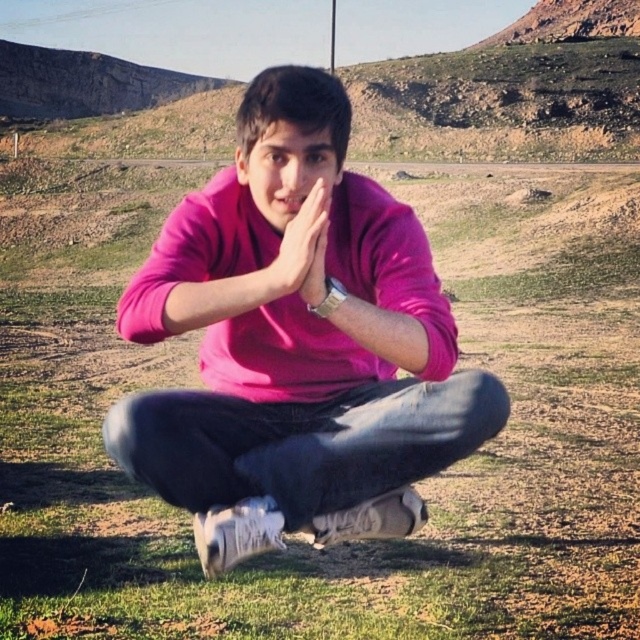
Is green grass at center to the right of pink matte hands at center from the viewer's perspective?

No, green grass at center is not to the right of pink matte hands at center.

Is green grass at center wider than pink matte hands at center?

Yes, green grass at center is wider than pink matte hands at center.

Where is `green grass at center`? green grass at center is located at coordinates (417, 486).

Find the location of a particular element. green grass at center is located at coordinates (417, 486).

Can you confirm if green grass at center is shorter than pink matte sweater at center?

In fact, green grass at center may be taller than pink matte sweater at center.

This screenshot has width=640, height=640. I want to click on green grass at center, so click(x=417, y=486).

Describe the element at coordinates (296, 346) in the screenshot. I see `pink matte sweater at center` at that location.

Between pink matte sweater at center and pink matte hands at center, which one appears on the right side from the viewer's perspective?

pink matte hands at center

Where is `pink matte sweater at center`? The image size is (640, 640). pink matte sweater at center is located at coordinates 296,346.